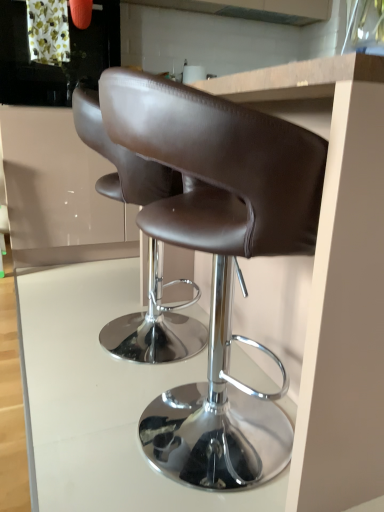
Identify the location of free spot above metallic gray exhaust hood at upper center (from a real-world perspective). (263, 14).